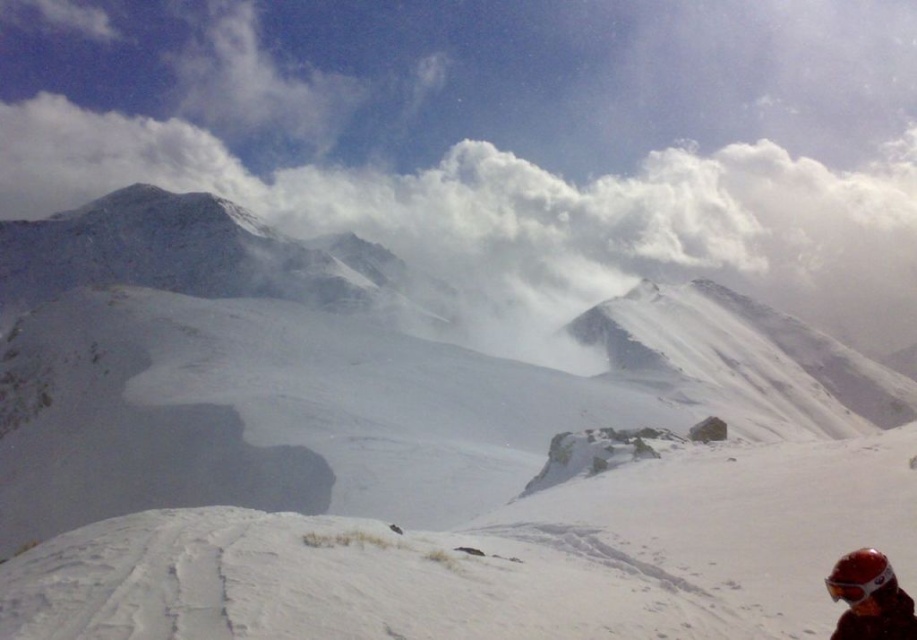
Question: Does white fluffy cloud at upper center have a larger size compared to matte orange helmet at lower right?

Choices:
 (A) no
 (B) yes

Answer: (B)

Question: Is white fluffy cloud at upper center below matte red goggles at lower right?

Choices:
 (A) no
 (B) yes

Answer: (A)

Question: Which of the following is the farthest from the observer?

Choices:
 (A) matte red goggles at lower right
 (B) white fluffy cloud at upper center
 (C) matte orange helmet at lower right

Answer: (B)

Question: Is white fluffy cloud at upper center further to the viewer compared to matte orange helmet at lower right?

Choices:
 (A) no
 (B) yes

Answer: (B)

Question: Which object appears closest to the camera in this image?

Choices:
 (A) white fluffy cloud at upper center
 (B) matte red goggles at lower right
 (C) matte orange helmet at lower right

Answer: (C)

Question: Among these objects, which one is nearest to the camera?

Choices:
 (A) matte orange helmet at lower right
 (B) white fluffy cloud at upper center
 (C) matte red goggles at lower right

Answer: (A)